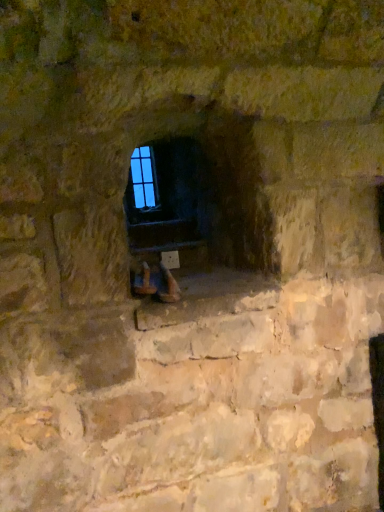
Question: Is point [236, 220] closer or farther from the camera than point [135, 183]?

Choices:
 (A) closer
 (B) farther

Answer: (A)

Question: From a real-world perspective, is smooth stone fireplace at center positioned above or below blue glass window at center?

Choices:
 (A) below
 (B) above

Answer: (A)

Question: Considering the positions of smooth stone fireplace at center and blue glass window at center in the image, is smooth stone fireplace at center bigger or smaller than blue glass window at center?

Choices:
 (A) small
 (B) big

Answer: (B)

Question: Is blue glass window at center bigger or smaller than smooth stone fireplace at center?

Choices:
 (A) small
 (B) big

Answer: (A)

Question: Is blue glass window at center in front of or behind smooth stone fireplace at center in the image?

Choices:
 (A) behind
 (B) front

Answer: (A)

Question: In terms of width, does blue glass window at center look wider or thinner when compared to smooth stone fireplace at center?

Choices:
 (A) thin
 (B) wide

Answer: (A)

Question: From a real-world perspective, relative to smooth stone fireplace at center, is blue glass window at center vertically above or below?

Choices:
 (A) below
 (B) above

Answer: (B)